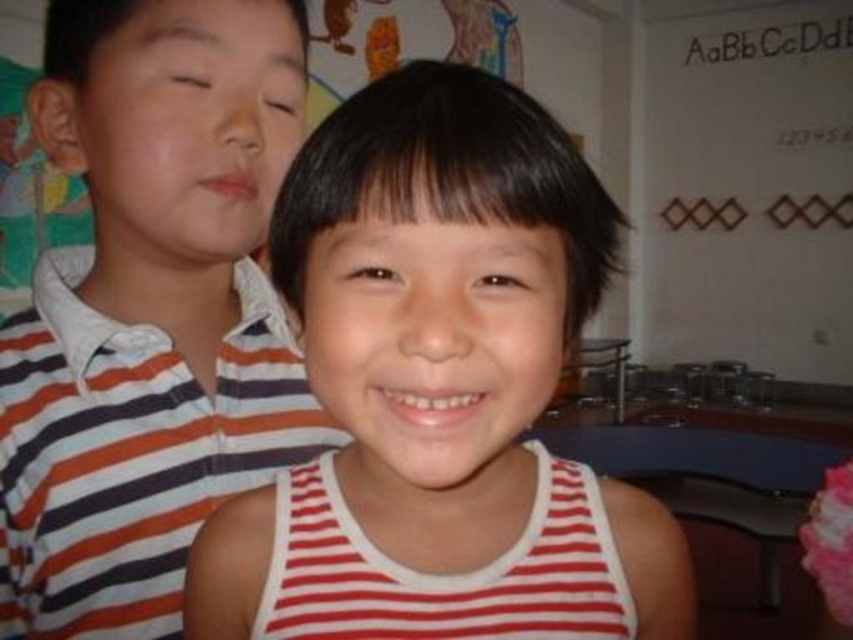
Question: Which point is farther from the camera taking this photo?

Choices:
 (A) (90, 364)
 (B) (349, 356)

Answer: (A)

Question: Does striped cotton shirt at upper left appear over white striped tank top at center?

Choices:
 (A) no
 (B) yes

Answer: (B)

Question: Is striped cotton shirt at upper left above white striped tank top at center?

Choices:
 (A) yes
 (B) no

Answer: (A)

Question: Which point is farther to the camera?

Choices:
 (A) (310, 442)
 (B) (442, 390)

Answer: (A)

Question: Does striped cotton shirt at upper left lie in front of white striped tank top at center?

Choices:
 (A) no
 (B) yes

Answer: (A)